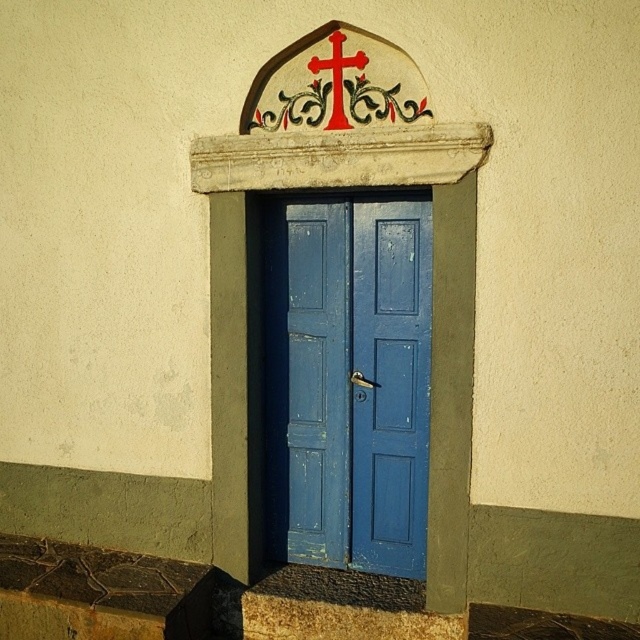
Question: Considering the relative positions of blue wooden door at center and red painted wood cross at upper center in the image provided, where is blue wooden door at center located with respect to red painted wood cross at upper center?

Choices:
 (A) above
 (B) below

Answer: (B)

Question: Which point is closer to the camera taking this photo?

Choices:
 (A) (360, 51)
 (B) (410, 273)

Answer: (A)

Question: Among these objects, which one is nearest to the camera?

Choices:
 (A) blue wooden door at center
 (B) red painted wood cross at upper center

Answer: (B)

Question: Is blue wooden door at center to the right of red painted wood cross at upper center from the viewer's perspective?

Choices:
 (A) no
 (B) yes

Answer: (B)

Question: Is blue wooden door at center positioned at the back of red painted wood cross at upper center?

Choices:
 (A) no
 (B) yes

Answer: (B)